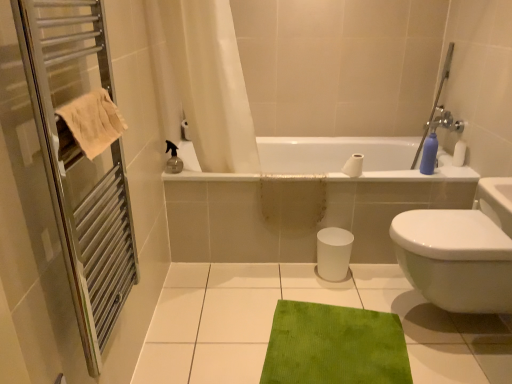
Locate an element on the screen. vacant space situated above green textured mat at lower center (from a real-world perspective) is located at coordinates (315, 313).